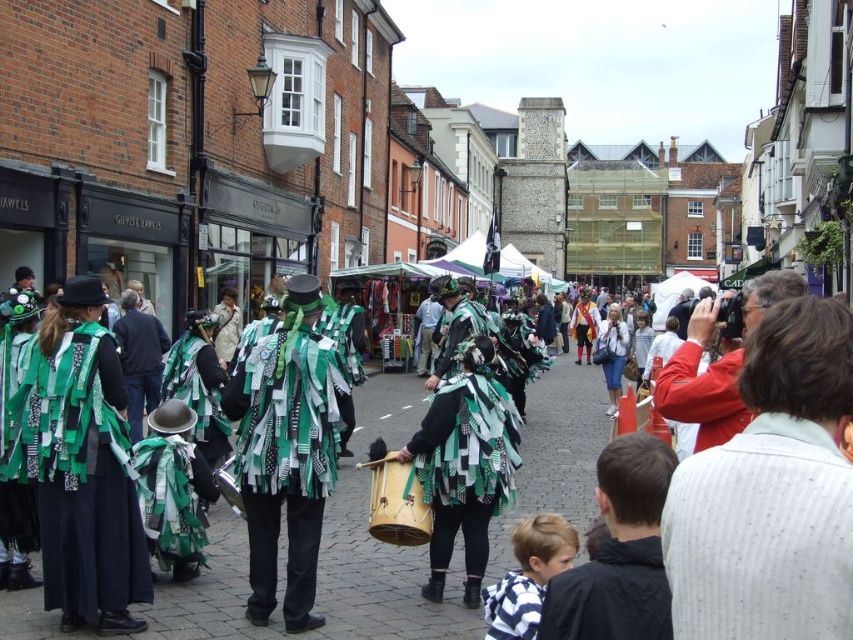
Who is higher up, red jacket at right or green fabric costumes at center?

red jacket at right is higher up.

Is point (809, 621) less distant than point (425, 624)?

That is True.

You are a GUI agent. You are given a task and a screenshot of the screen. Output one action in this format:
    pyautogui.click(x=<x>, y=<y>)
    Task: Click on the red jacket at right
    This screenshot has width=853, height=640.
    Given the screenshot: What is the action you would take?
    pyautogui.click(x=770, y=493)

Who is taller, green fabric costumes at center or red cotton jacket at right?

red cotton jacket at right

Does green fabric costumes at center lie behind red cotton jacket at right?

No, it is not.

Which is in front, point (498, 531) or point (668, 397)?

Point (668, 397)

At what (x,y) coordinates should I click in order to perform the action: click on green fabric costumes at center. Please return your answer as a coordinate pair (x, y). The height and width of the screenshot is (640, 853). Looking at the image, I should click on (328, 557).

Looking at this image, how much distance is there between red jacket at right and wooden drum at center?

63.94 feet

Can you confirm if red jacket at right is bigger than wooden drum at center?

Yes, red jacket at right is bigger than wooden drum at center.

What do you see at coordinates (770, 493) in the screenshot?
I see `red jacket at right` at bounding box center [770, 493].

Locate an element on the screen. This screenshot has width=853, height=640. red jacket at right is located at coordinates (770, 493).